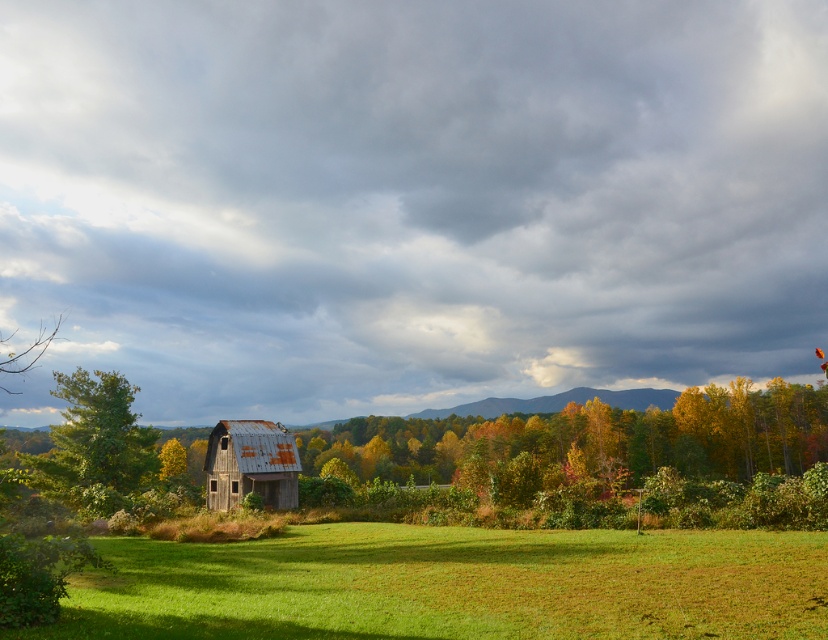
Question: Considering the real-world distances, which object is farthest from the rusty metal barn at center?

Choices:
 (A) cloudy sky at upper center
 (B) yellow-green foliage at lower left
 (C) rusty metal barn at left
 (D) green leafy tree at left

Answer: (A)

Question: Which object is closer to the camera taking this photo?

Choices:
 (A) green grassy field at lower center
 (B) cloudy sky at upper center

Answer: (A)

Question: Is green grassy field at lower center below rusty metal barn at center?

Choices:
 (A) no
 (B) yes

Answer: (A)

Question: Can you confirm if rusty metal barn at left is bigger than green leafy tree at left?

Choices:
 (A) yes
 (B) no

Answer: (A)

Question: From the image, what is the correct spatial relationship of cloudy sky at upper center in relation to green leafy tree at left?

Choices:
 (A) below
 (B) above

Answer: (B)

Question: Which point is farther to the camera?

Choices:
 (A) (330, 580)
 (B) (634, 368)
 (C) (350, 468)
 (D) (266, 440)

Answer: (B)